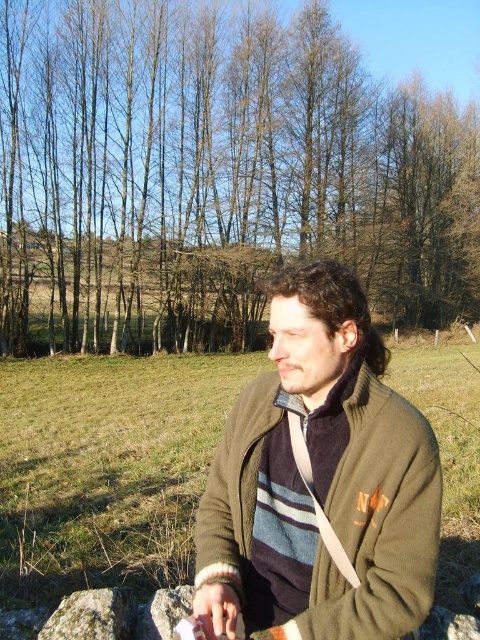
You are planning to place a small birdhouse between the brown bark tree at upper center and the green mossy rock at lower left. Which object should the birdhouse be closer to in order to maintain balance between their widths?

The birdhouse should be closer to the green mossy rock at lower left because the brown bark tree at upper center is wider than the green mossy rock at lower left, so placing it closer to the smaller width object balances the composition.

You are a photographer trying to capture the green fuzzy sweater at center in your shot. If your camera has a rectangular viewfinder with a 1.5 aspect ratio, where should you position the sweater relative to the frame to ensure it is centered?

The green fuzzy sweater at center is already positioned at the center of the frame at coordinates approximately 0.753 on the x and 0.667 on the y axis, so you should keep it there to maintain the centered composition.

You are a hiker who needs to navigate from the green mossy rock at lower left to the brown bark tree at upper center. Given that your average walking pace is 1.4 meters per second, approximately how many seconds will it take you to reach the tree if you walk directly towards it?

The distance between the green mossy rock at lower left and the brown bark tree at upper center is 29.54 meters. At a pace of 1.4 meters per second, dividing the distance by the speed gives approximately 21.1 seconds. Therefore, it will take roughly 21 seconds to reach the tree.